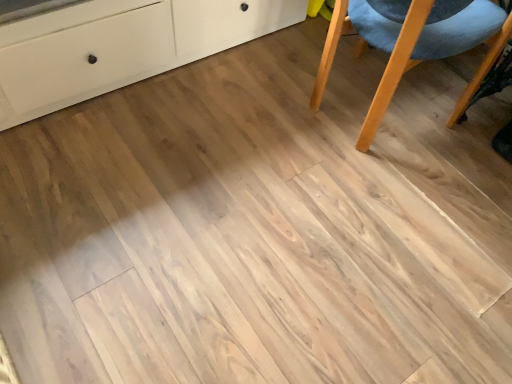
Question: Looking at the image, does light wood chair at right seem bigger or smaller compared to matte white cabinet at upper left?

Choices:
 (A) big
 (B) small

Answer: (B)

Question: Considering the positions of point (394, 29) and point (151, 66), is point (394, 29) closer or farther from the camera than point (151, 66)?

Choices:
 (A) closer
 (B) farther

Answer: (A)

Question: Is light wood chair at right in front of or behind matte white cabinet at upper left in the image?

Choices:
 (A) behind
 (B) front

Answer: (A)

Question: Looking at their shapes, would you say matte white cabinet at upper left is wider or thinner than light wood chair at right?

Choices:
 (A) wide
 (B) thin

Answer: (A)

Question: Is matte white cabinet at upper left taller or shorter than light wood chair at right?

Choices:
 (A) short
 (B) tall

Answer: (A)

Question: Is matte white cabinet at upper left situated inside light wood chair at right or outside?

Choices:
 (A) outside
 (B) inside

Answer: (A)

Question: Relative to light wood chair at right, is matte white cabinet at upper left in front or behind?

Choices:
 (A) front
 (B) behind

Answer: (A)